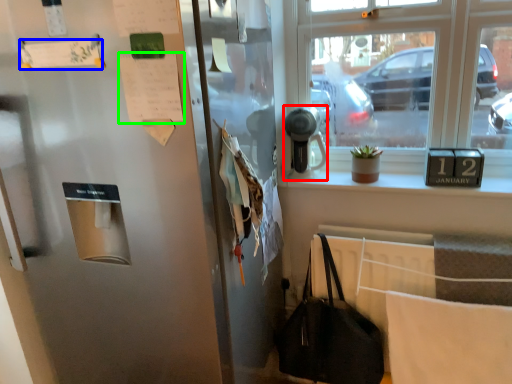
Question: Considering the real-world distances, which object is closest to appliance (highlighted by a red box)? paper (highlighted by a blue box) or paper (highlighted by a green box).

Choices:
 (A) paper
 (B) paper

Answer: (B)